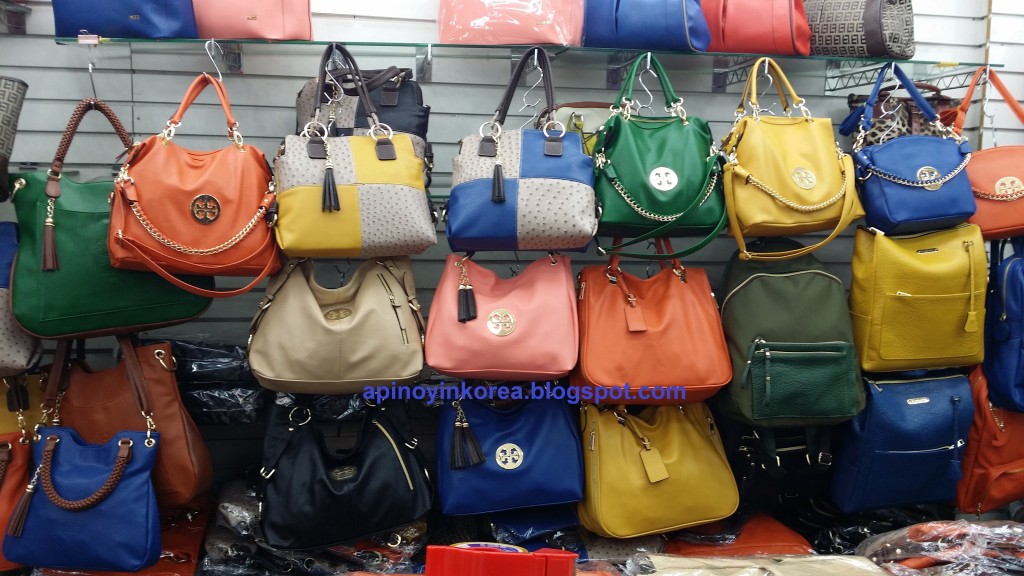
Identify the location of tassel. The image size is (1024, 576). (378, 212), (361, 221).